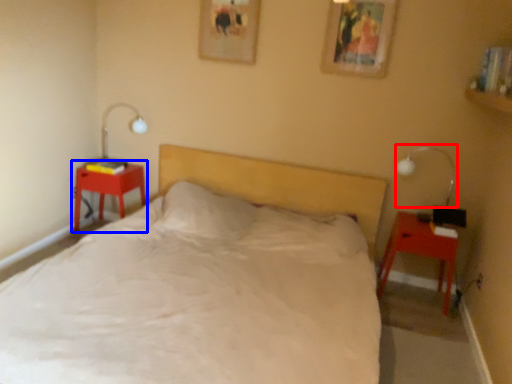
Question: Which of the following is the farthest to the observer, bedside lamp (highlighted by a red box) or nightstand (highlighted by a blue box)?

Choices:
 (A) bedside lamp
 (B) nightstand

Answer: (B)